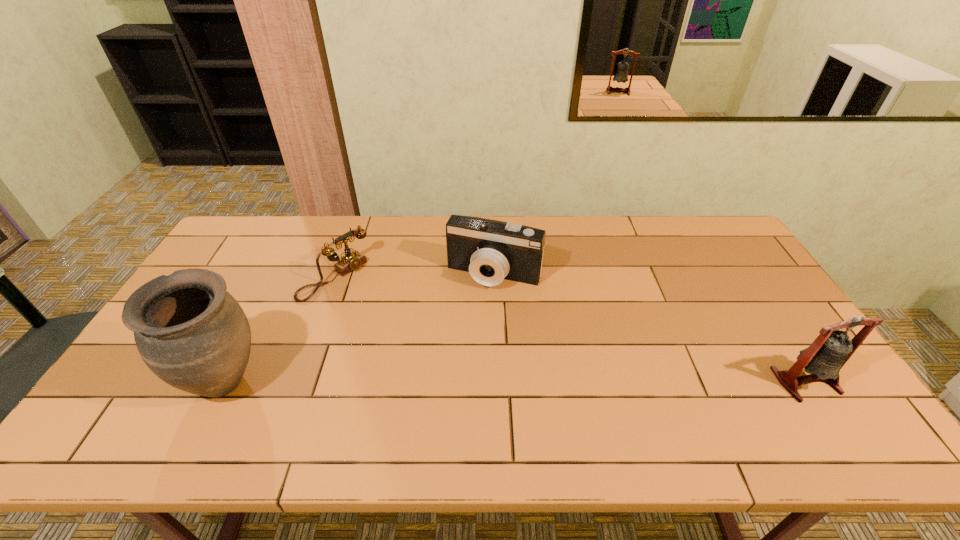
Where is `object situated at the near right corner`? object situated at the near right corner is located at coordinates (823, 359).

Identify the location of free space at the far edge. (534, 222).

Locate an element on the screen. The image size is (960, 540). free space at the near edge is located at coordinates (643, 394).

The height and width of the screenshot is (540, 960). I want to click on vacant area at the left edge, so click(x=143, y=361).

You are a GUI agent. You are given a task and a screenshot of the screen. Output one action in this format:
    pyautogui.click(x=<x>, y=<y>)
    Task: Click on the vacant region at the right edge of the desktop
    Image resolution: width=960 pixels, height=540 pixels.
    Given the screenshot: What is the action you would take?
    pyautogui.click(x=752, y=289)

Locate an element on the screen. The width and height of the screenshot is (960, 540). blank region between the camcorder and the shortest object is located at coordinates (415, 276).

You are a GUI agent. You are given a task and a screenshot of the screen. Output one action in this format:
    pyautogui.click(x=<x>, y=<y>)
    Task: Click on the vacant space that is in between the camcorder and the rightmost object
    The width and height of the screenshot is (960, 540).
    Given the screenshot: What is the action you would take?
    pos(650,328)

The width and height of the screenshot is (960, 540). Identify the location of free point between the second tallest object and the telephone. (570, 329).

The image size is (960, 540). What are the coordinates of `vacant space that's between the third shortest object and the urn` in the screenshot? It's located at (516, 381).

Identify the location of empty space that is in between the telephone and the camcorder. (415, 276).